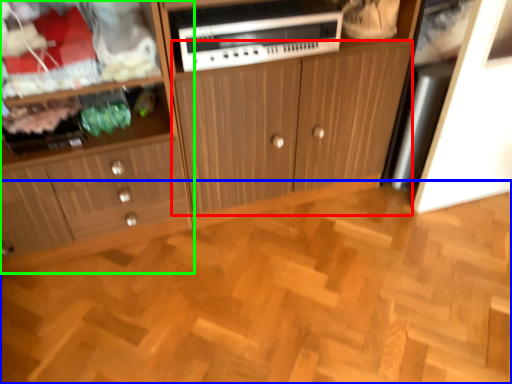
Question: Estimate the real-world distances between objects in this image. Which object is closer to cabinetry (highlighted by a red box), hardwood (highlighted by a blue box) or cabinetry (highlighted by a green box)?

Choices:
 (A) hardwood
 (B) cabinetry

Answer: (B)